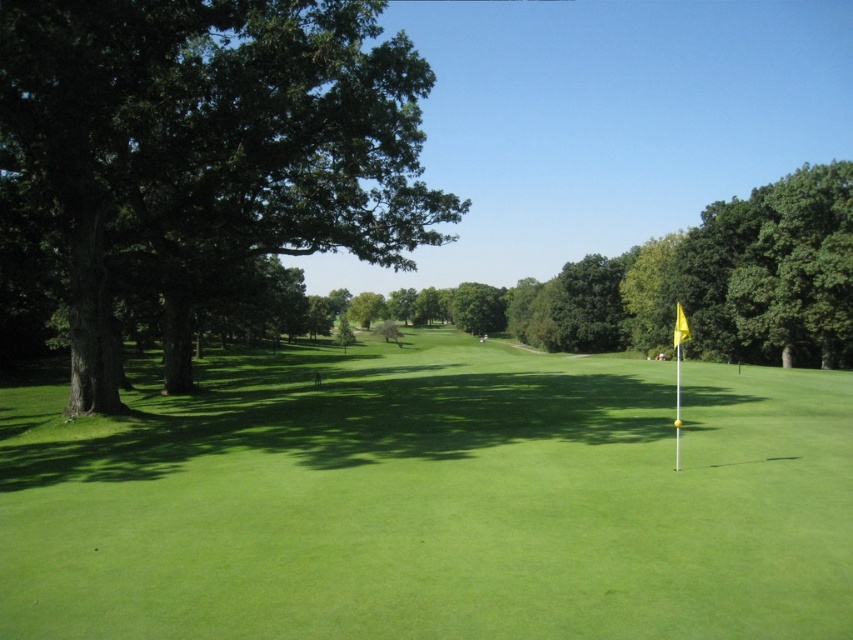
From the picture: Measure the distance between green grassy golf course at center and dark green leafy tree at left.

green grassy golf course at center is 37.83 feet from dark green leafy tree at left.

Does green grassy golf course at center have a smaller size compared to dark green leafy tree at left?

Yes, green grassy golf course at center is smaller than dark green leafy tree at left.

Where is `green grassy golf course at center`? The height and width of the screenshot is (640, 853). green grassy golf course at center is located at coordinates (432, 500).

At what (x,y) coordinates should I click in order to perform the action: click on green grassy golf course at center. Please return your answer as a coordinate pair (x, y). Image resolution: width=853 pixels, height=640 pixels. Looking at the image, I should click on (432, 500).

Between point (792, 461) and point (675, 324), which one is positioned in front?

Point (792, 461) is in front.

Which is more to the left, green grassy golf course at center or yellow fabric flag at right?

Positioned to the left is green grassy golf course at center.

Does point (659, 627) come farther from viewer compared to point (688, 332)?

No, (659, 627) is closer to viewer.

In order to click on green grassy golf course at center in this screenshot , I will do `click(432, 500)`.

Between dark green leafy tree at left and yellow fabric flag at right, which one has less height?

yellow fabric flag at right

Which is in front, point (64, 237) or point (676, 330)?

Point (676, 330) is more forward.

Locate an element on the screen. The width and height of the screenshot is (853, 640). dark green leafy tree at left is located at coordinates (209, 147).

I want to click on dark green leafy tree at left, so click(x=209, y=147).